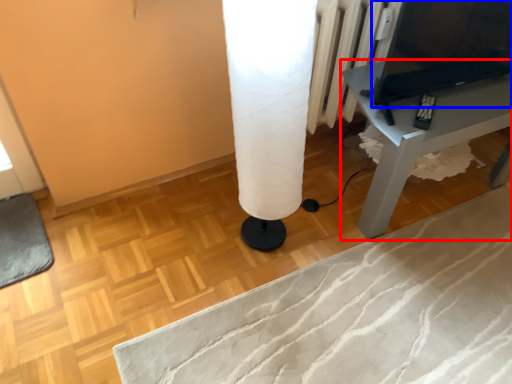
Question: Which point is closer to the camera, table (highlighted by a red box) or computer (highlighted by a blue box)?

Choices:
 (A) table
 (B) computer

Answer: (B)